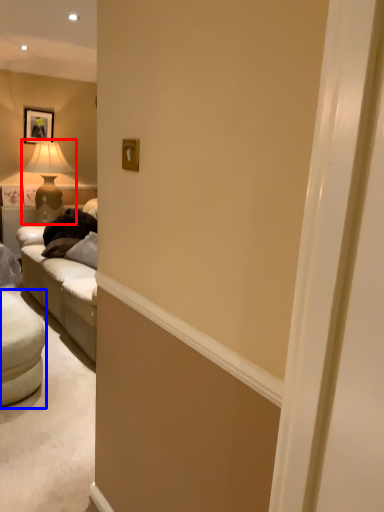
Question: Which point is closer to the camera, table lamp (highlighted by a red box) or studio couch (highlighted by a blue box)?

Choices:
 (A) table lamp
 (B) studio couch

Answer: (B)